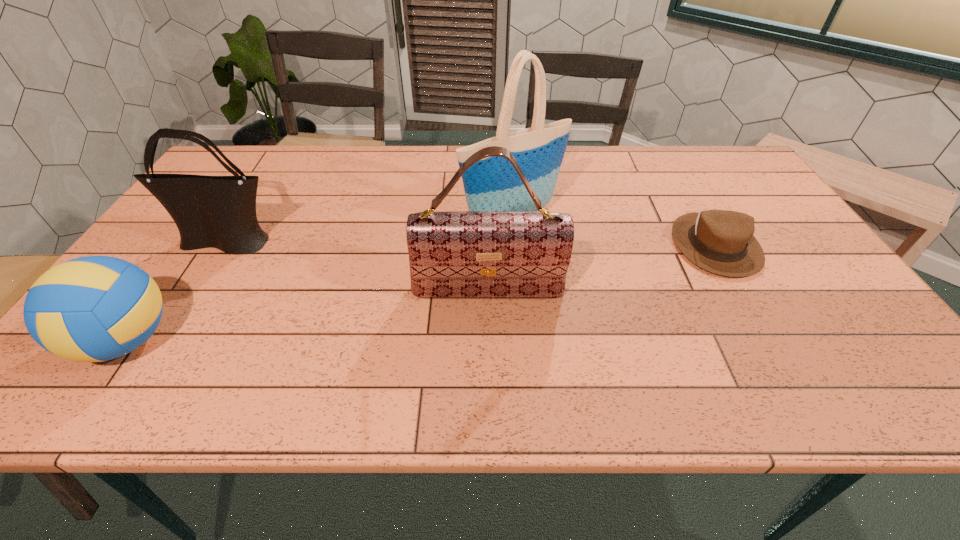
The image size is (960, 540). What are the coordinates of `free area in between the handbag and the fedora` in the screenshot? It's located at (602, 268).

Image resolution: width=960 pixels, height=540 pixels. I want to click on blank region between the handbag and the volleyball, so 307,316.

What are the coordinates of `free space between the tallest object and the shoulder bag` in the screenshot? It's located at (370, 231).

Point out which object is positioned as the nearest to the volleyball. Please provide its 2D coordinates. Your answer should be formatted as a tuple, i.e. [(x, y)], where the tuple contains the x and y coordinates of a point satisfying the conditions above.

[(219, 212)]

Identify the location of the closest object relative to the fourth tallest object. This screenshot has height=540, width=960. (219, 212).

Find the location of a particular element. This screenshot has width=960, height=540. free spot that satisfies the following two spatial constraints: 1. on the back side of the tote bag; 2. on the right side of the volleyball is located at coordinates (212, 219).